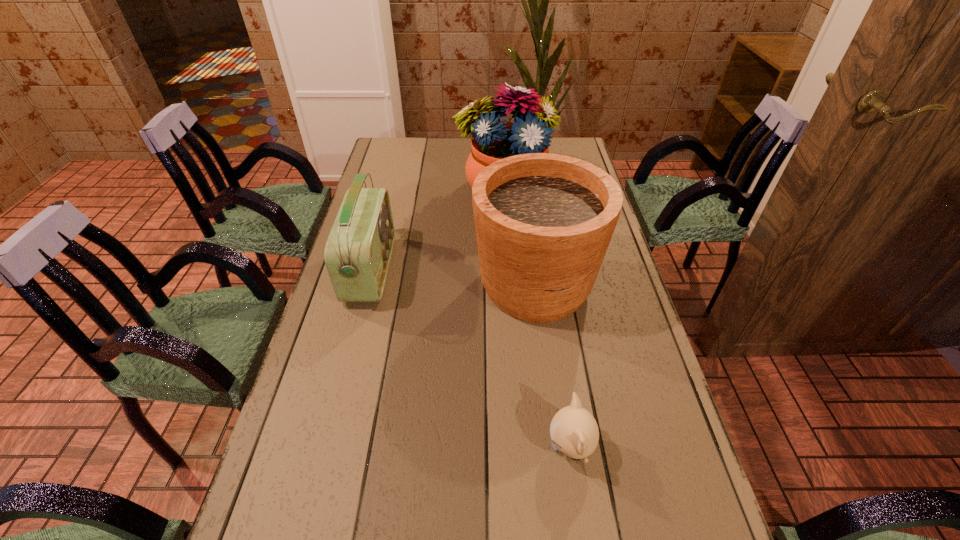
Where is `free spot between the farthest object and the leftmost object`? free spot between the farthest object and the leftmost object is located at coordinates (438, 231).

The image size is (960, 540). Find the location of `empty location between the second shortest object and the shortest object`. empty location between the second shortest object and the shortest object is located at coordinates (470, 359).

The image size is (960, 540). Find the location of `unoccupied position between the shortest object and the second tallest object`. unoccupied position between the shortest object and the second tallest object is located at coordinates (553, 366).

You are a GUI agent. You are given a task and a screenshot of the screen. Output one action in this format:
    pyautogui.click(x=<x>, y=<y>)
    Task: Click on the object that is the third closest one to the leftmost object
    
    Given the screenshot: What is the action you would take?
    pyautogui.click(x=574, y=431)

Locate which object ranks in proximity to the radio receiver. Please provide its 2D coordinates. Your answer should be formatted as a tuple, i.e. [(x, y)], where the tuple contains the x and y coordinates of a point satisfying the conditions above.

[(492, 140)]